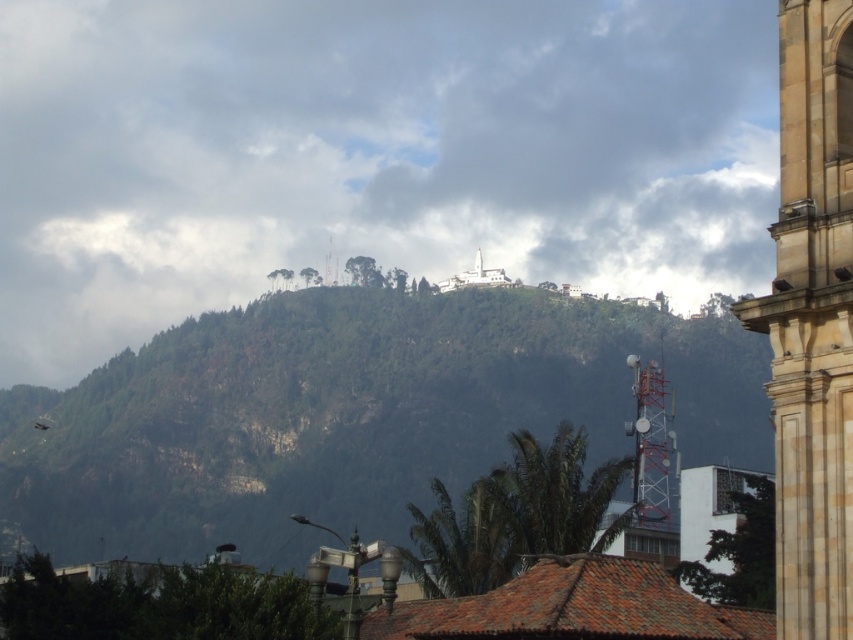
Question: Which object is farther from the camera taking this photo?

Choices:
 (A) green forested hill at center
 (B) brown stone tower at right
 (C) white marble church at upper center

Answer: (C)

Question: Which of the following is the closest to the observer?

Choices:
 (A) (848, 497)
 (B) (398, 332)

Answer: (A)

Question: Is green forested hill at center wider than white marble church at upper center?

Choices:
 (A) yes
 (B) no

Answer: (A)

Question: Does green forested hill at center have a larger size compared to white marble church at upper center?

Choices:
 (A) no
 (B) yes

Answer: (B)

Question: Does brown stone tower at right have a smaller size compared to white marble church at upper center?

Choices:
 (A) no
 (B) yes

Answer: (A)

Question: Which object appears closest to the camera in this image?

Choices:
 (A) green forested hill at center
 (B) white marble church at upper center
 (C) brown stone tower at right

Answer: (C)